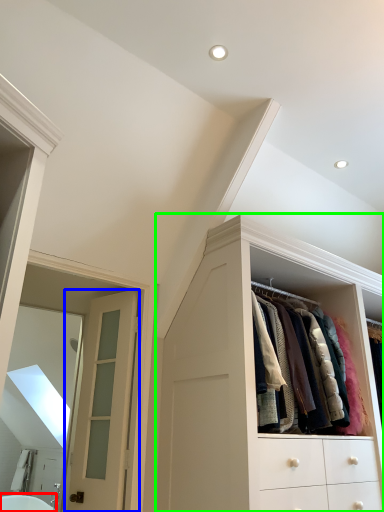
Question: Considering the real-world distances, which object is farthest from bath (highlighted by a red box)? door (highlighted by a blue box) or cabinetry (highlighted by a green box)?

Choices:
 (A) door
 (B) cabinetry

Answer: (B)